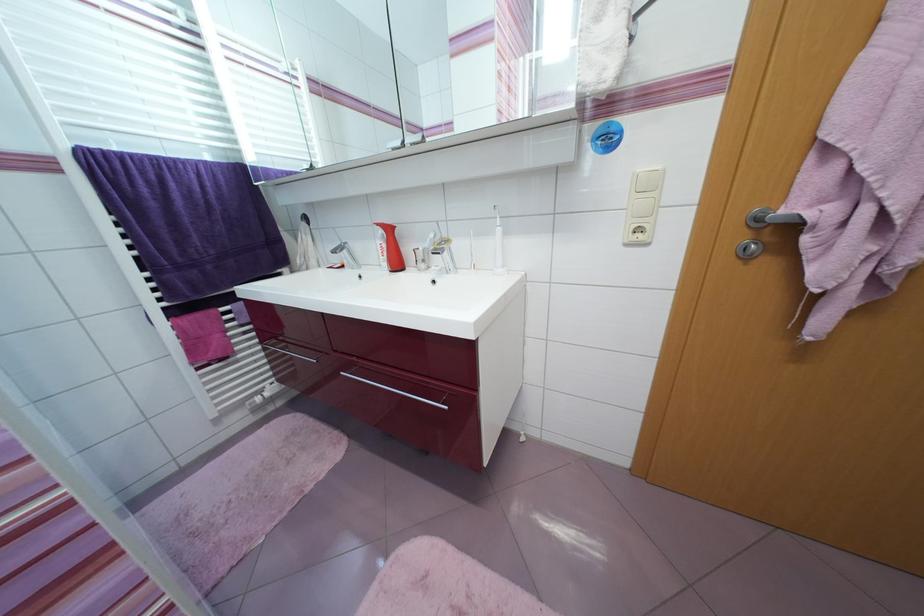
Find where to turn the metal door handle. Please return your answer as a coordinate pair (x, y).

(763, 229)